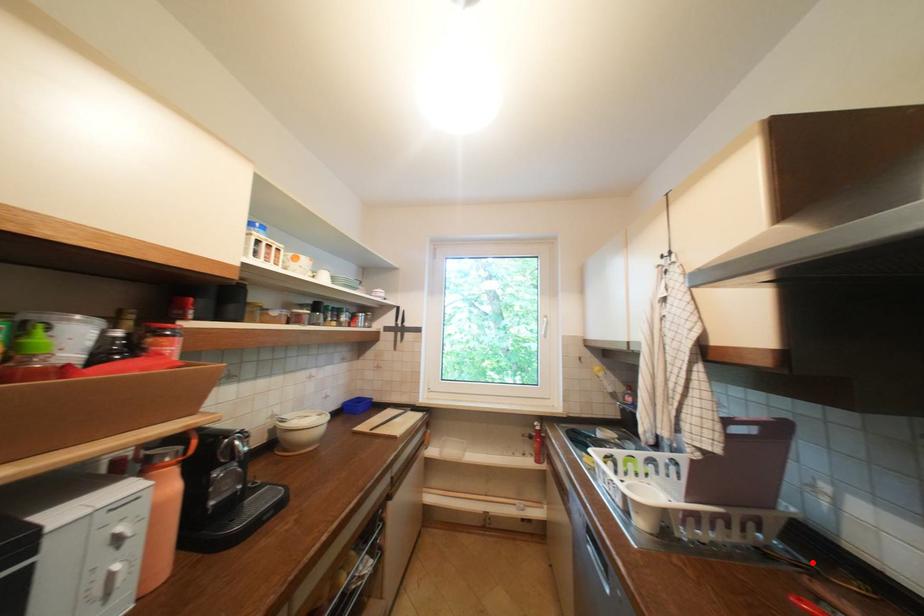
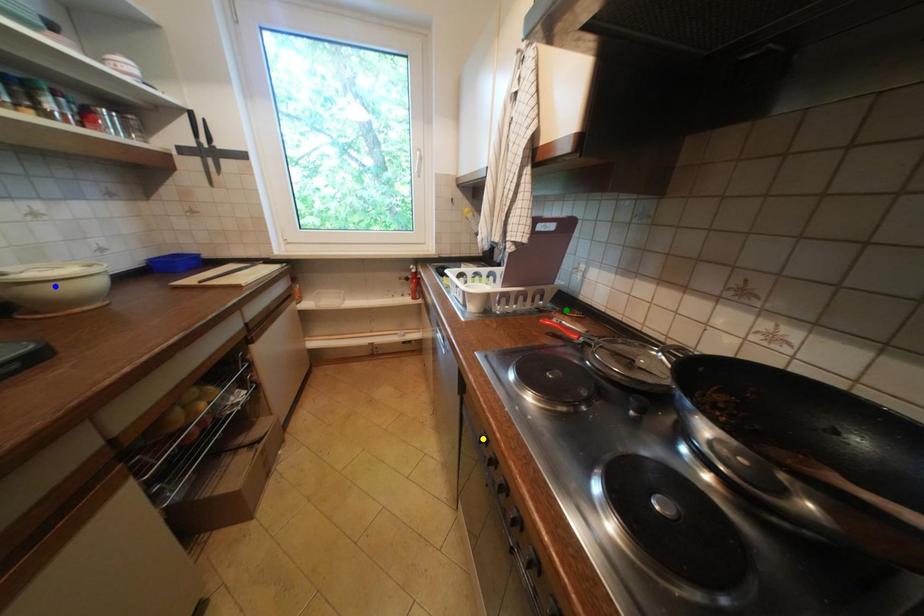
Question: I am providing you with two images of the same scene from different viewpoints. A red point is marked on the first image. You are given multiple points on the second image. Which point in image 2 is actually the same real-world point as the red point in image 1?

Choices:
 (A) green point
 (B) blue point
 (C) yellow point

Answer: (A)